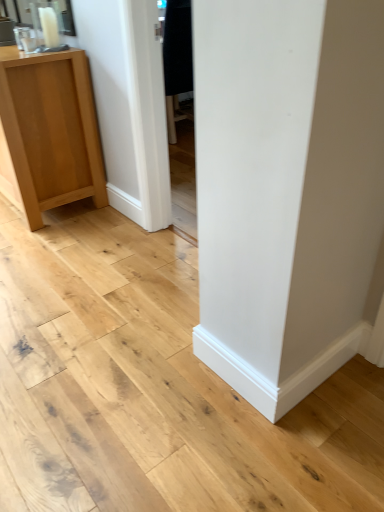
Describe the element at coordinates (48, 133) in the screenshot. I see `light brown wood cabinet at left` at that location.

Where is `light brown wood cabinet at left`? Image resolution: width=384 pixels, height=512 pixels. light brown wood cabinet at left is located at coordinates (48, 133).

In order to face light brown wood cabinet at left, should I rotate leftwards or rightwards?

To align with it, rotate left about 22.646°.

Image resolution: width=384 pixels, height=512 pixels. In order to click on light brown wood cabinet at left in this screenshot , I will do `click(48, 133)`.